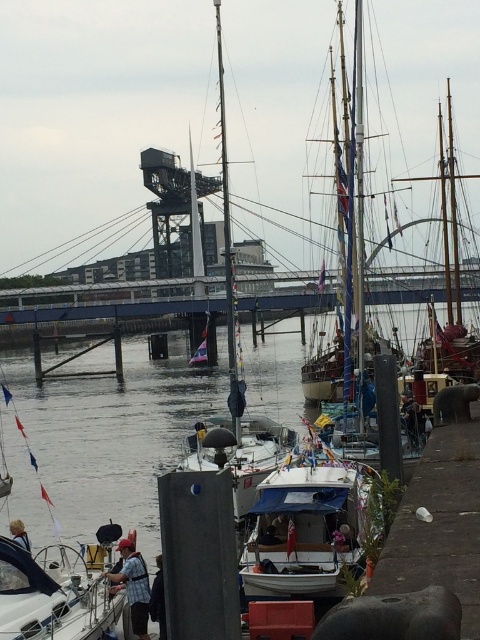
Question: From the image, what is the correct spatial relationship of wooden sailboat at center in relation to white glossy sailboat at lower left?

Choices:
 (A) left
 (B) right

Answer: (B)

Question: Which point is farther to the camera?

Choices:
 (A) (24, 580)
 (B) (362, 195)

Answer: (B)

Question: Based on their relative distances, which object is nearer to the white matte boat at center?

Choices:
 (A) wooden sailboat at center
 (B) white glossy sailboat at lower left
 (C) metallic gray bridge at center

Answer: (B)

Question: Where is wooden sailboat at center located in relation to white glossy sailboat at lower left in the image?

Choices:
 (A) right
 (B) left

Answer: (A)

Question: Estimate the real-world distances between objects in this image. Which object is farther from the wooden sailboat at center?

Choices:
 (A) white matte boat at center
 (B) white glossy sailboat at lower left

Answer: (B)

Question: Can you confirm if white matte boat at center is positioned below white glossy sailboat at lower left?

Choices:
 (A) no
 (B) yes

Answer: (A)